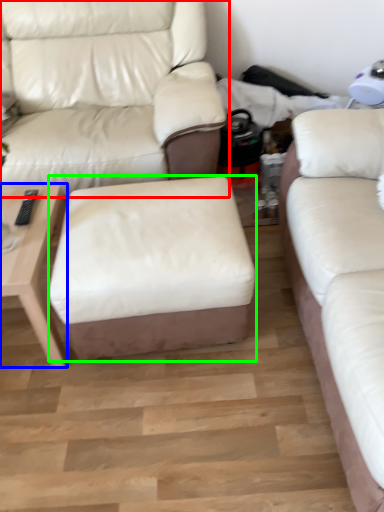
Question: Which is farther away from studio couch (highlighted by a red box)? table (highlighted by a blue box) or stool (highlighted by a green box)?

Choices:
 (A) table
 (B) stool

Answer: (A)